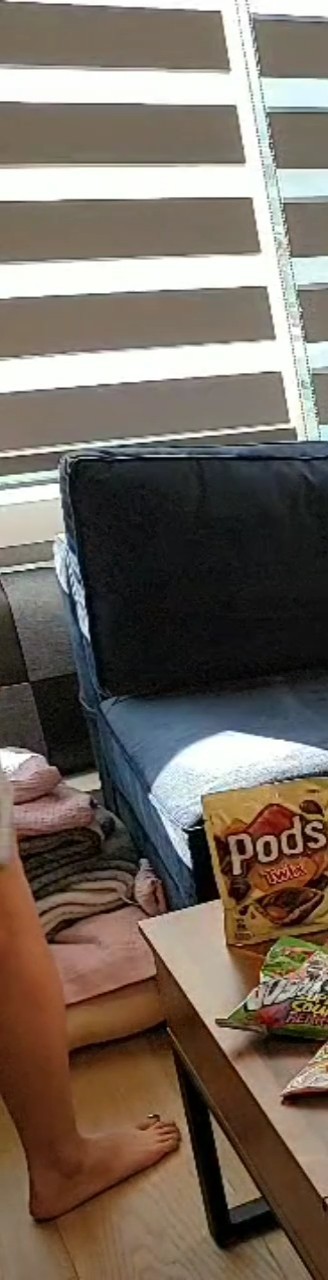
This screenshot has width=328, height=1280. Identify the location of table top. (242, 1123).